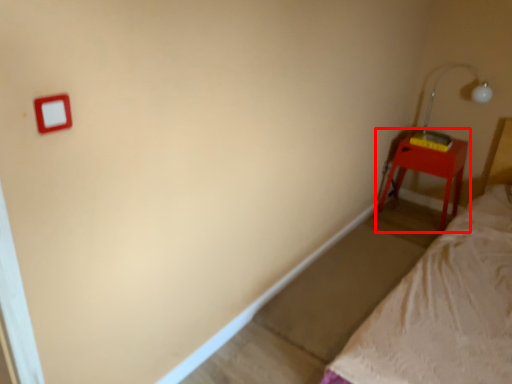
Question: From the image's perspective, what is the correct spatial positioning of nightstand (annotated by the red box) in reference to lamp?

Choices:
 (A) below
 (B) above

Answer: (A)